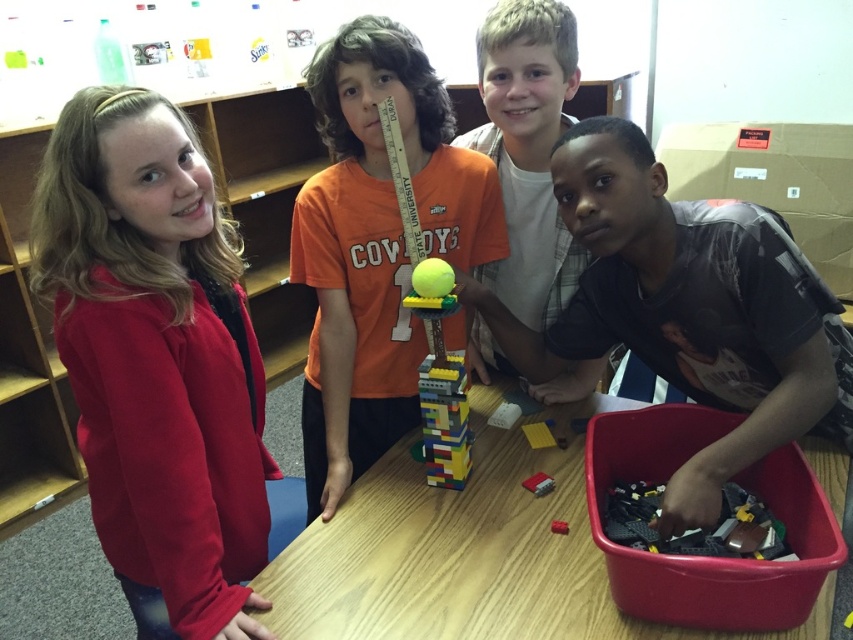
Can you confirm if matte black shirt at lower right is thinner than smooth plastic lego block at center?

No, matte black shirt at lower right is not thinner than smooth plastic lego block at center.

Is point (804, 404) farther from viewer compared to point (518, 412)?

No, (804, 404) is closer to viewer.

You are a GUI agent. You are given a task and a screenshot of the screen. Output one action in this format:
    pyautogui.click(x=<x>, y=<y>)
    Task: Click on the matte black shirt at lower right
    This screenshot has width=853, height=640.
    Given the screenshot: What is the action you would take?
    pyautogui.click(x=688, y=308)

Is point (77, 365) farther from camera compared to point (476, 332)?

No, (77, 365) is closer to viewer.

Is the position of matte red sweater at left less distant than that of smooth white shirt at center?

Yes, matte red sweater at left is in front of smooth white shirt at center.

Does point (45, 275) come closer to viewer compared to point (544, 307)?

That is True.

The image size is (853, 640). Find the location of `matte red sweater at left`. matte red sweater at left is located at coordinates (155, 360).

Is matte red sweater at left positioned at the back of matte black shirt at lower right?

No, it is not.

Does matte red sweater at left have a larger size compared to matte black shirt at lower right?

No, matte red sweater at left is not bigger than matte black shirt at lower right.

Does point (144, 492) come behind point (602, 152)?

That is False.

What are the coordinates of `matte red sweater at left` in the screenshot? It's located at (155, 360).